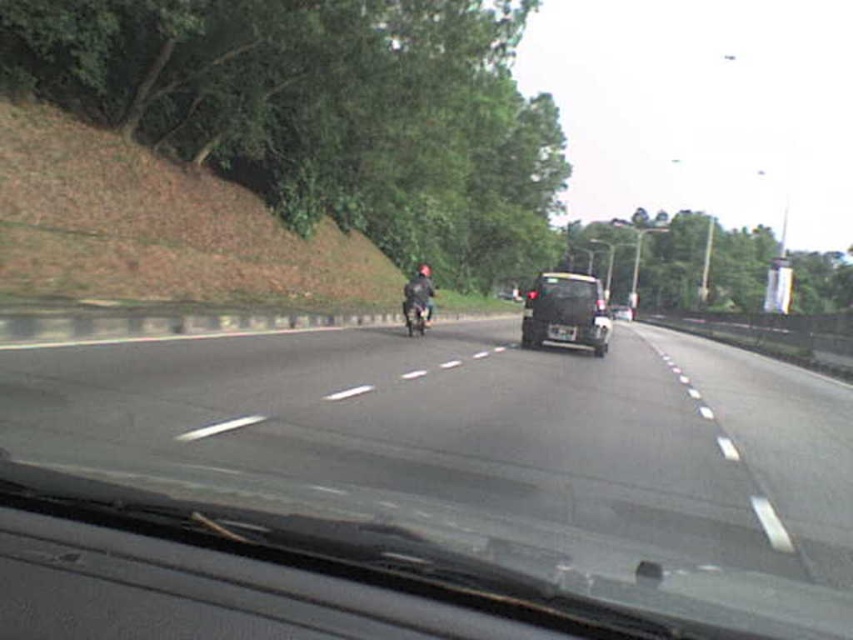
You are driving a car and looking through the windshield. You see the black asphalt road at center and the black matte van at center. Which object is closer to you?

The black asphalt road at center is closer to you because it is in front of the black matte van at center.

You are a driver in a vehicle and want to switch lanes to the right. There is a black matte van at center and a shiny metallic motorcycle at center. Which vehicle will you need to check for clearance before making the lane change?

The shiny metallic motorcycle at center is wider than the black matte van at center, so you should check clearance for the shiny metallic motorcycle at center first before changing lanes to the right.